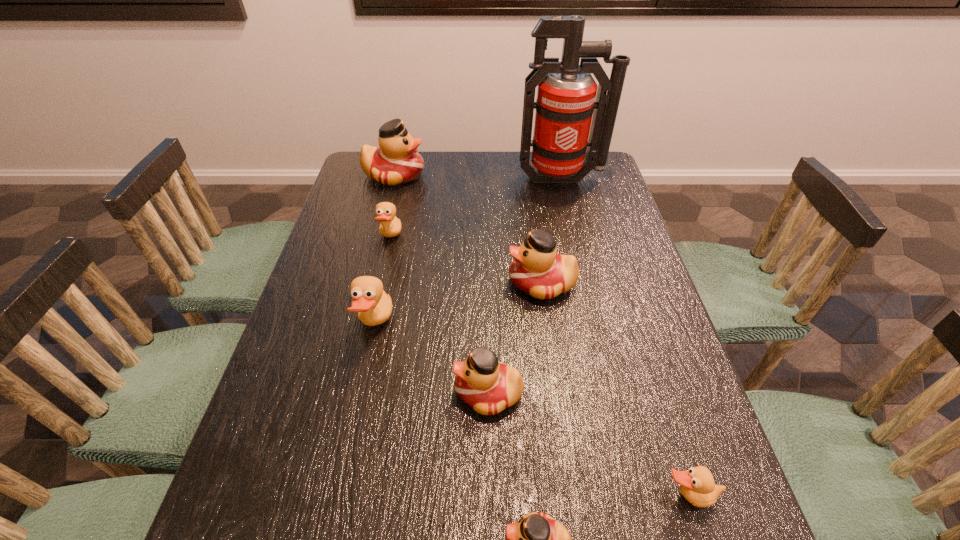
At what (x,y) coordinates should I click in order to perform the action: click on vacant region at the right edge of the desktop. Please return your answer as a coordinate pair (x, y). Image resolution: width=960 pixels, height=540 pixels. Looking at the image, I should click on (607, 281).

You are a GUI agent. You are given a task and a screenshot of the screen. Output one action in this format:
    pyautogui.click(x=<x>, y=<y>)
    Task: Click on the free space at the far right corner
    
    Given the screenshot: What is the action you would take?
    pyautogui.click(x=588, y=177)

This screenshot has height=540, width=960. I want to click on free space that is in between the third nearest object and the sixth nearest duck, so click(x=440, y=316).

This screenshot has height=540, width=960. In order to click on vacant space in between the third smallest red duck and the sixth farthest object in this screenshot , I will do `click(516, 338)`.

Locate an element on the screen. Image resolution: width=960 pixels, height=540 pixels. vacant region between the tallest duck and the red fire extinguisher is located at coordinates (478, 177).

At what (x,y) coordinates should I click in order to perform the action: click on free space between the second tallest object and the third farthest red duck. Please return your answer as a coordinate pair (x, y). This screenshot has height=540, width=960. Looking at the image, I should click on pyautogui.click(x=442, y=284).

I want to click on blank region between the third nearest red duck and the second nearest red duck, so click(x=516, y=338).

Locate an element on the screen. Image resolution: width=960 pixels, height=540 pixels. empty space between the second farthest red duck and the second nearest duck is located at coordinates (614, 390).

Identify the location of object that stands as the seventh closest to the smallest tan duck. The width and height of the screenshot is (960, 540). (396, 161).

Select which object appears as the sixth closest to the third farthest object. Please provide its 2D coordinates. Your answer should be formatted as a tuple, i.e. [(x, y)], where the tuple contains the x and y coordinates of a point satisfying the conditions above.

[(537, 539)]